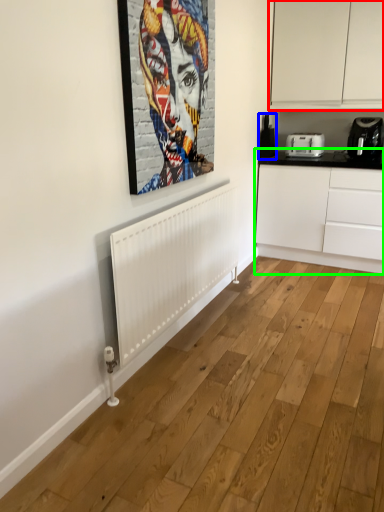
Question: Based on their relative distances, which object is farther from cabinetry (highlighted by a red box)? Choose from appliance (highlighted by a blue box) and cabinetry (highlighted by a green box).

Choices:
 (A) appliance
 (B) cabinetry

Answer: (B)